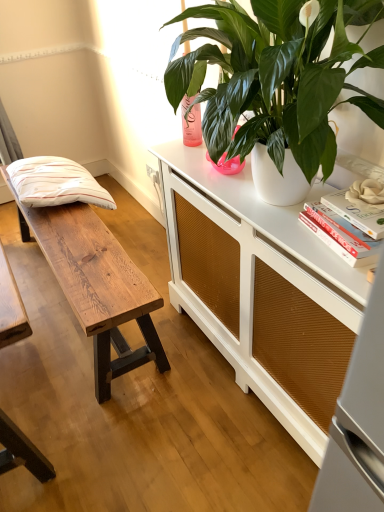
Question: Would you say white matte flower at upper right is to the left or to the right of white striped pillow at left in the picture?

Choices:
 (A) right
 (B) left

Answer: (A)

Question: Considering their positions, is white matte flower at upper right located in front of or behind white striped pillow at left?

Choices:
 (A) front
 (B) behind

Answer: (A)

Question: Considering the real-world distances, which object is closest to the white matte book at upper right, the 1th book ordered from the bottom?

Choices:
 (A) white textured cabinet at center
 (B) white striped pillow at left
 (C) green glossy leafy plant at upper right
 (D) white matte flower at upper right
 (E) wooden bench at left

Answer: (D)

Question: Estimate the real-world distances between objects in this image. Which object is farther from the green glossy leafy plant at upper right?

Choices:
 (A) white striped pillow at left
 (B) white matte book at upper right, the 2th book from the top
 (C) wooden bench at left
 (D) white textured cabinet at center
 (E) white matte book at upper right, the 2th book positioned from the bottom

Answer: (A)